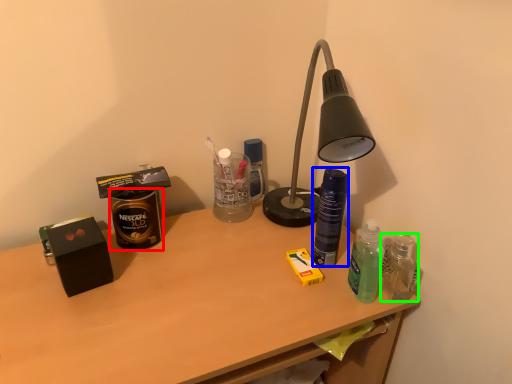
Question: Estimate the real-world distances between objects in this image. Which object is farther from beverage (highlighted by a red box), bottle (highlighted by a blue box) or bottle (highlighted by a green box)?

Choices:
 (A) bottle
 (B) bottle

Answer: (B)